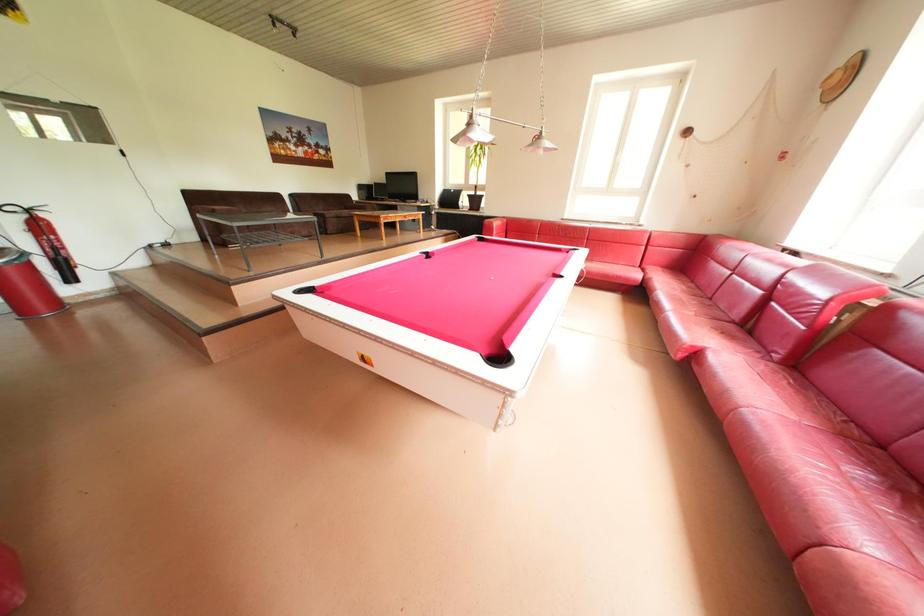
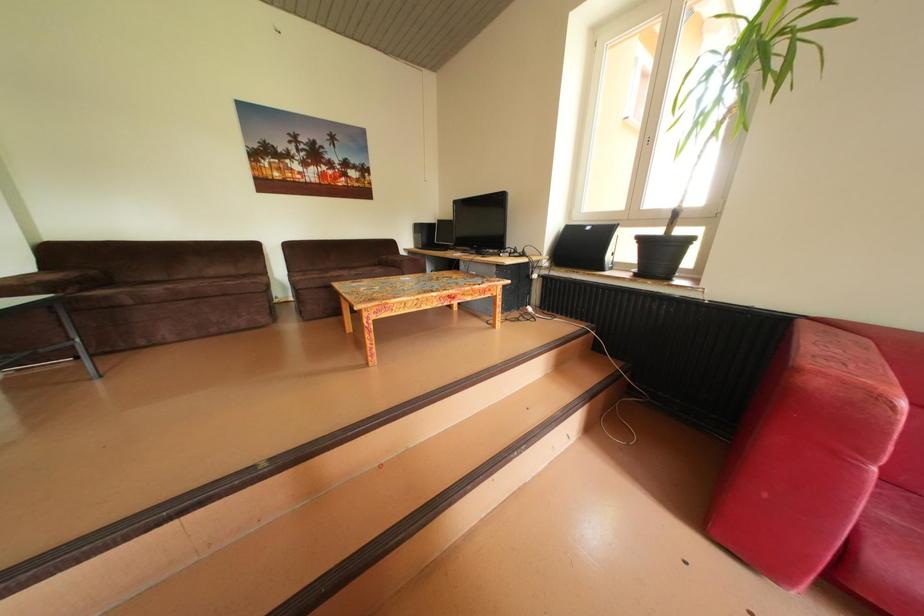
Question: Which direction would the cameraman need to move to produce the second image? Reply with the corresponding letter.

Choices:
 (A) Left
 (B) Right
 (C) Forward
 (D) Backward

Answer: (C)